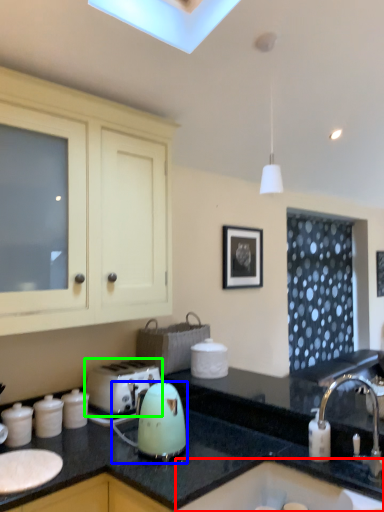
Question: Based on their relative distances, which object is farther from sink (highlighted by a red box)? Choose from kitchen appliance (highlighted by a blue box) and toaster (highlighted by a green box).

Choices:
 (A) kitchen appliance
 (B) toaster

Answer: (B)